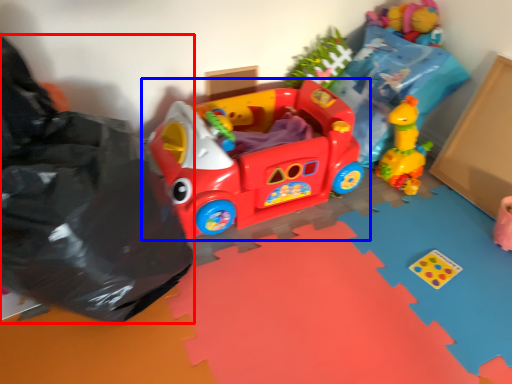
Question: Among these objects, which one is nearest to the camera, garbage (highlighted by a red box) or toy (highlighted by a blue box)?

Choices:
 (A) garbage
 (B) toy

Answer: (A)